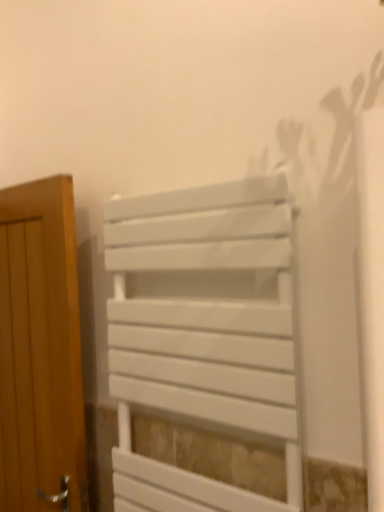
Question: Considering the positions of point [258, 298] and point [46, 211], is point [258, 298] closer or farther from the camera than point [46, 211]?

Choices:
 (A) closer
 (B) farther

Answer: (A)

Question: Is white matte radiator at center taller or shorter than wooden door at left?

Choices:
 (A) tall
 (B) short

Answer: (B)

Question: From a real-world perspective, is white matte radiator at center positioned above or below wooden door at left?

Choices:
 (A) below
 (B) above

Answer: (B)

Question: Considering the positions of wooden door at left and white matte radiator at center in the image, is wooden door at left bigger or smaller than white matte radiator at center?

Choices:
 (A) big
 (B) small

Answer: (A)

Question: Does point (34, 333) appear closer or farther from the camera than point (104, 226)?

Choices:
 (A) farther
 (B) closer

Answer: (A)

Question: In the image, is wooden door at left positioned in front of or behind white matte radiator at center?

Choices:
 (A) behind
 (B) front

Answer: (A)

Question: Is wooden door at left inside or outside of white matte radiator at center?

Choices:
 (A) inside
 (B) outside

Answer: (B)